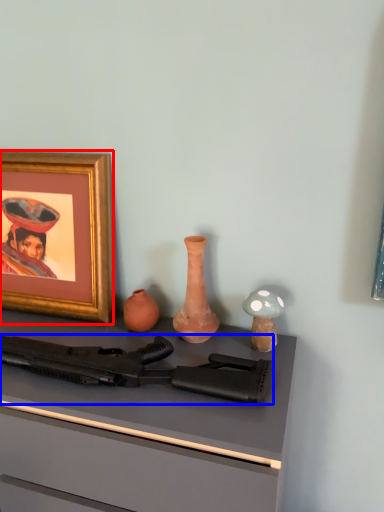
Question: Which object is further to the camera taking this photo, picture frame (highlighted by a red box) or rifle (highlighted by a blue box)?

Choices:
 (A) picture frame
 (B) rifle

Answer: (A)